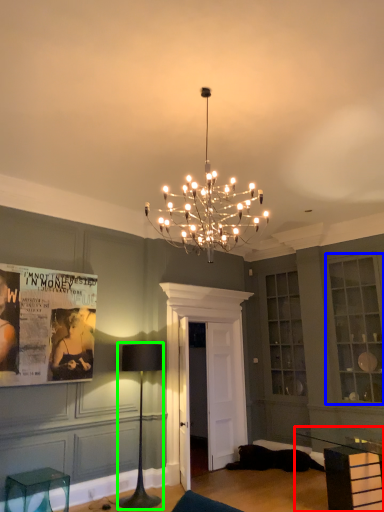
Question: Based on their relative distances, which object is farther from table (highlighted by a red box)? Choose from cabinetry (highlighted by a blue box) and table lamp (highlighted by a green box).

Choices:
 (A) cabinetry
 (B) table lamp

Answer: (B)